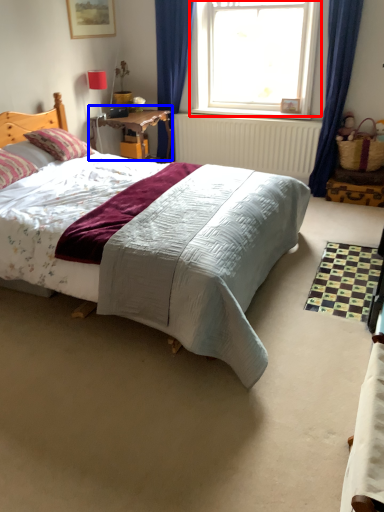
Question: Which object is further to the camera taking this photo, window (highlighted by a red box) or table (highlighted by a blue box)?

Choices:
 (A) window
 (B) table

Answer: (B)